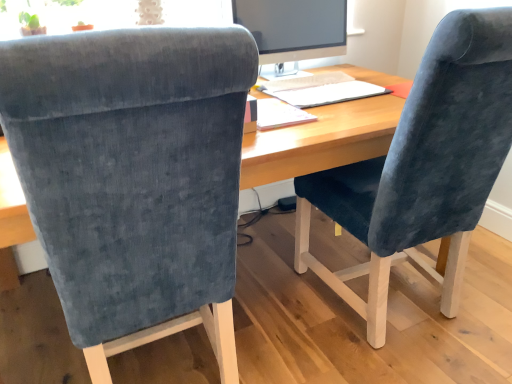
The width and height of the screenshot is (512, 384). Find the location of `vacant area that is in front of white paper notepad at center`. vacant area that is in front of white paper notepad at center is located at coordinates (303, 136).